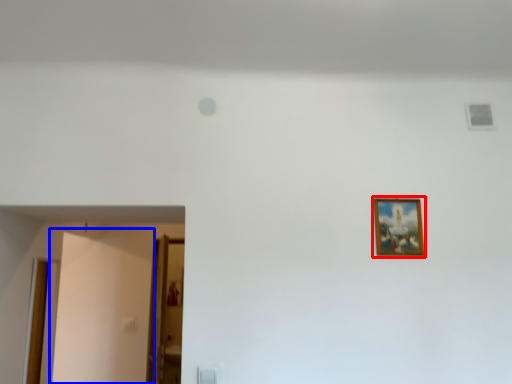
Question: Which object appears farthest to the camera in this image, picture frame (highlighted by a red box) or door (highlighted by a blue box)?

Choices:
 (A) picture frame
 (B) door

Answer: (B)